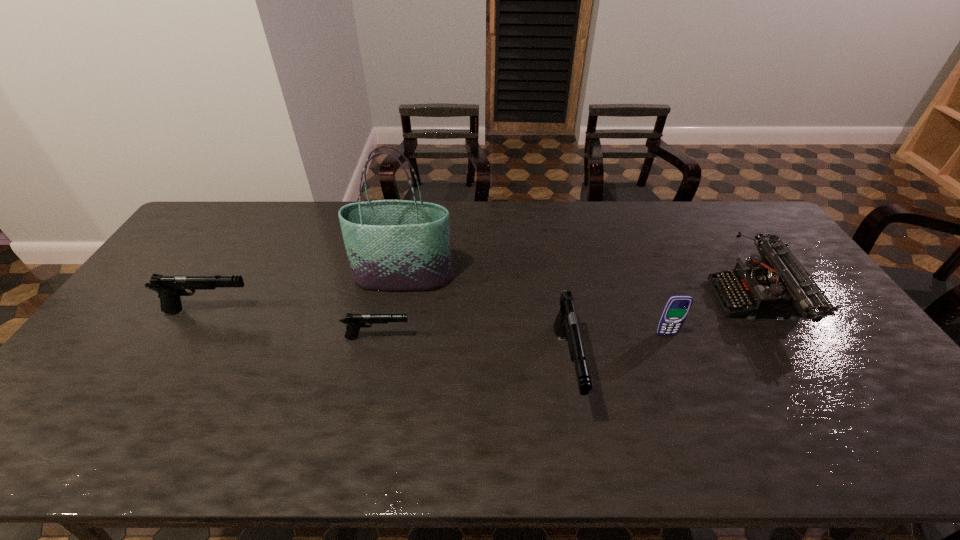
Please show where to add a gun on the right while keeping spacing even. Please provide its 2D coordinates. Your answer should be formatted as a tuple, i.e. [(x, y)], where the tuple contains the x and y coordinates of a point satisfying the conditions above.

[(780, 401)]